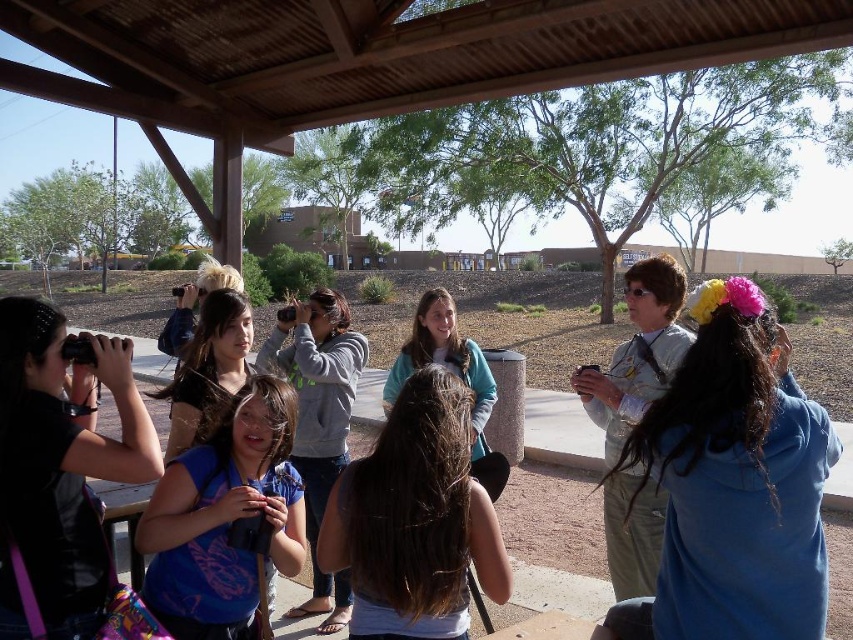
You are a photographer trying to capture a clear photo of the group under the wooden pavilion. The brown hair at center and the blue matte shirt at center are both in your camera frame. Which one should you focus on to ensure the subject with the larger width is sharp?

The brown hair at center is wider than the blue matte shirt at center, so focusing on the brown hair at center will ensure the wider subject is sharp.

You are a photographer trying to capture a group photo of the people under the wooden pavilion. You notice the brown hair at center and the teal sweater at center. Which of these two would you need to adjust the camera focus for if you want to ensure the wider subject is in sharp detail?

The brown hair at center is wider than the teal sweater at center, so you should adjust the camera focus for the brown hair at center to ensure the wider subject is in sharp detail.